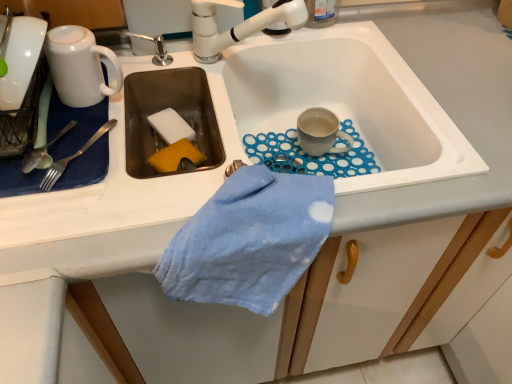
The image size is (512, 384). I want to click on free space in front of shiny silver fork at left, which is counted as the 3th silverware, starting from the right, so coord(56,231).